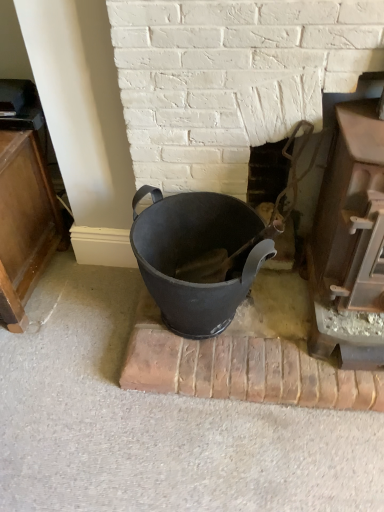
Question: Is smooth black bucket at center, the 1th fireplace positioned from the left, turned away from matte black bucket at center?

Choices:
 (A) yes
 (B) no

Answer: (A)

Question: Is matte black bucket at center surrounded by smooth black bucket at center, the 1th fireplace positioned from the left?

Choices:
 (A) no
 (B) yes

Answer: (A)

Question: Is smooth black bucket at center, the 1th fireplace positioned from the left, completely or partially outside of matte black bucket at center?

Choices:
 (A) yes
 (B) no

Answer: (A)

Question: Is smooth black bucket at center, which is counted as the 3th fireplace, starting from the right, aimed at matte black bucket at center?

Choices:
 (A) no
 (B) yes

Answer: (B)

Question: From a real-world perspective, is smooth black bucket at center, the 1th fireplace positioned from the left, under matte black bucket at center?

Choices:
 (A) no
 (B) yes

Answer: (A)

Question: Is smooth black bucket at center, which is counted as the 3th fireplace, starting from the right, touching matte black bucket at center?

Choices:
 (A) no
 (B) yes

Answer: (A)

Question: Is smooth black bucket at center, the 1th fireplace positioned from the left, next to smooth brown wood at right, the 1th fireplace positioned from the right?

Choices:
 (A) yes
 (B) no

Answer: (B)

Question: Considering the relative sizes of smooth black bucket at center, which is counted as the 3th fireplace, starting from the right, and smooth brown wood at right, the 1th fireplace positioned from the right, in the image provided, is smooth black bucket at center, which is counted as the 3th fireplace, starting from the right, thinner than smooth brown wood at right, the 1th fireplace positioned from the right,?

Choices:
 (A) no
 (B) yes

Answer: (B)

Question: Is smooth black bucket at center, the 1th fireplace positioned from the left, not close to smooth brown wood at right, which ranks as the 3th fireplace in left-to-right order?

Choices:
 (A) yes
 (B) no

Answer: (B)

Question: Can you confirm if smooth black bucket at center, the 1th fireplace positioned from the left, is positioned to the right of smooth brown wood at right, which ranks as the 3th fireplace in left-to-right order?

Choices:
 (A) yes
 (B) no

Answer: (B)

Question: Would you say smooth black bucket at center, the 1th fireplace positioned from the left, contains smooth brown wood at right, which ranks as the 3th fireplace in left-to-right order?

Choices:
 (A) no
 (B) yes

Answer: (A)

Question: Considering the relative positions of smooth black bucket at center, which is counted as the 3th fireplace, starting from the right, and smooth brown wood at right, which ranks as the 3th fireplace in left-to-right order, in the image provided, is smooth black bucket at center, which is counted as the 3th fireplace, starting from the right, behind smooth brown wood at right, which ranks as the 3th fireplace in left-to-right order,?

Choices:
 (A) yes
 (B) no

Answer: (A)

Question: Does smooth metal fireplace at center, marked as the second fireplace in a left-to-right arrangement, have a lesser height compared to smooth brown wood at right, the 1th fireplace positioned from the right?

Choices:
 (A) no
 (B) yes

Answer: (B)